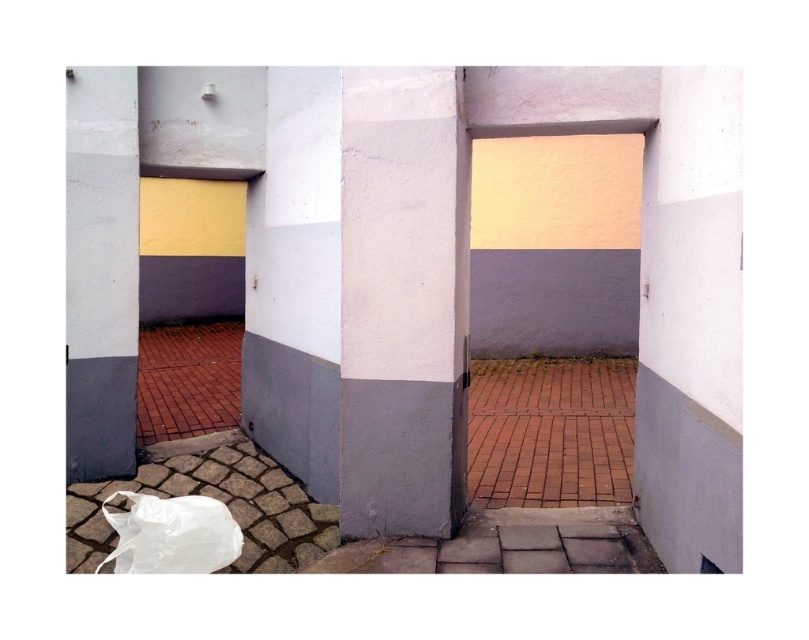
Question: Is white matte pillar at center positioned at the back of matte gray concrete pillar at left?

Choices:
 (A) yes
 (B) no

Answer: (B)

Question: Which point appears closest to the camera in this image?

Choices:
 (A) (437, 452)
 (B) (176, 536)

Answer: (B)

Question: Which object is positioned closest to the white matte pillar at center?

Choices:
 (A) matte gray concrete pillar at left
 (B) white plastic bag at lower left

Answer: (B)

Question: Does white matte pillar at center lie in front of white plastic bag at lower left?

Choices:
 (A) yes
 (B) no

Answer: (B)

Question: Which of the following is the closest to the observer?

Choices:
 (A) (121, 570)
 (B) (409, 161)
 (C) (90, 449)

Answer: (A)

Question: Is matte gray concrete pillar at left further to camera compared to white plastic bag at lower left?

Choices:
 (A) no
 (B) yes

Answer: (B)